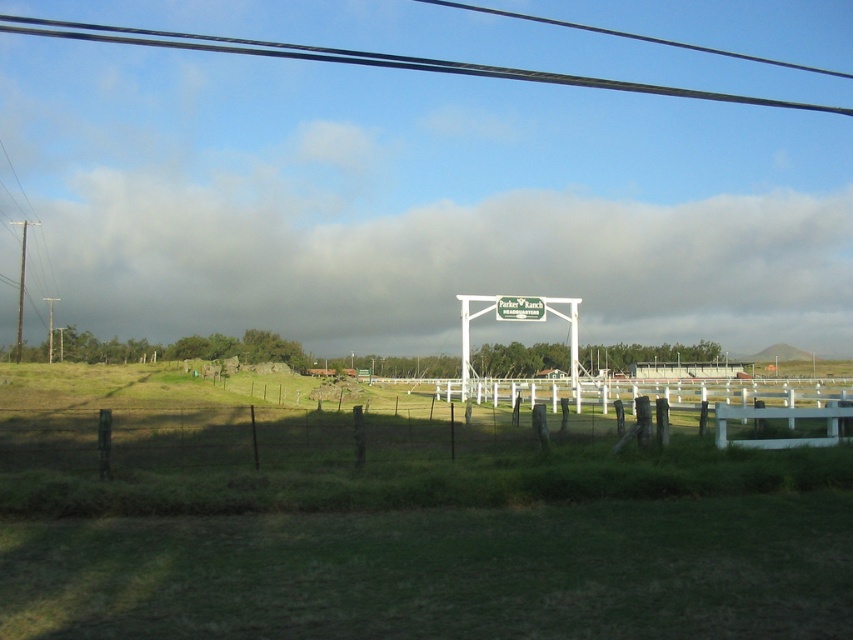
You are standing at the fence in the rural landscape scene. You see two points marked in the image. The first point is at coordinate point (142, 198) and the second is at point (370, 424). Which point is closer to you?

Point (142, 198) is further to the camera than point (370, 424), so the point closer to you is point (370, 424).

You are standing in the middle of the field and looking towards the wooden fence at lower center. Which direction should you look to see the cloudy sky at upper center?

The cloudy sky at upper center is positioned on the left side of wooden fence at lower center. So, you should look to your left to see the cloudy sky at upper center while facing the wooden fence at lower center.